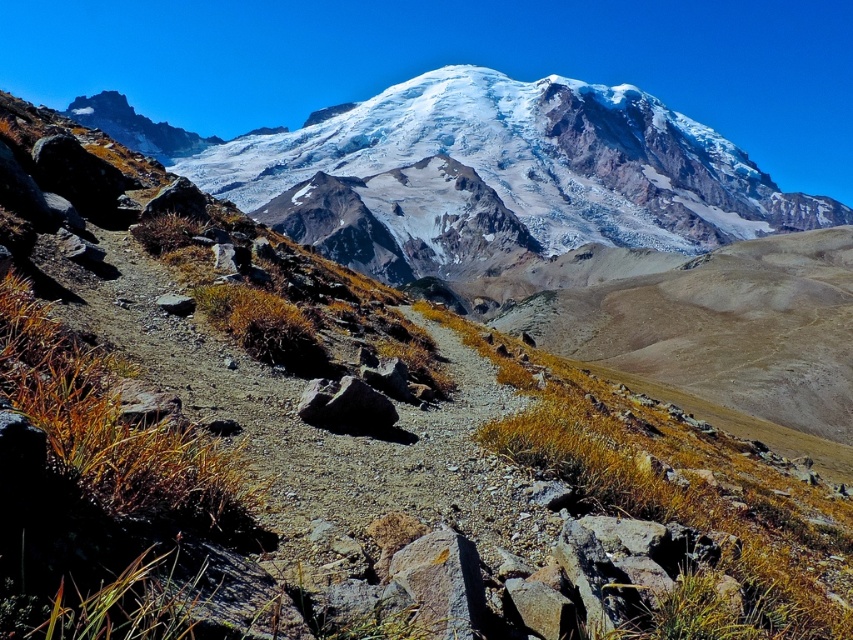
Describe the element at coordinates (500, 177) in the screenshot. The image size is (853, 640). I see `snowy granite mountain at upper center` at that location.

Image resolution: width=853 pixels, height=640 pixels. Identify the location of snowy granite mountain at upper center. (500, 177).

Find the location of a particular element. Image resolution: width=853 pixels, height=640 pixels. snowy granite mountain at upper center is located at coordinates tap(500, 177).